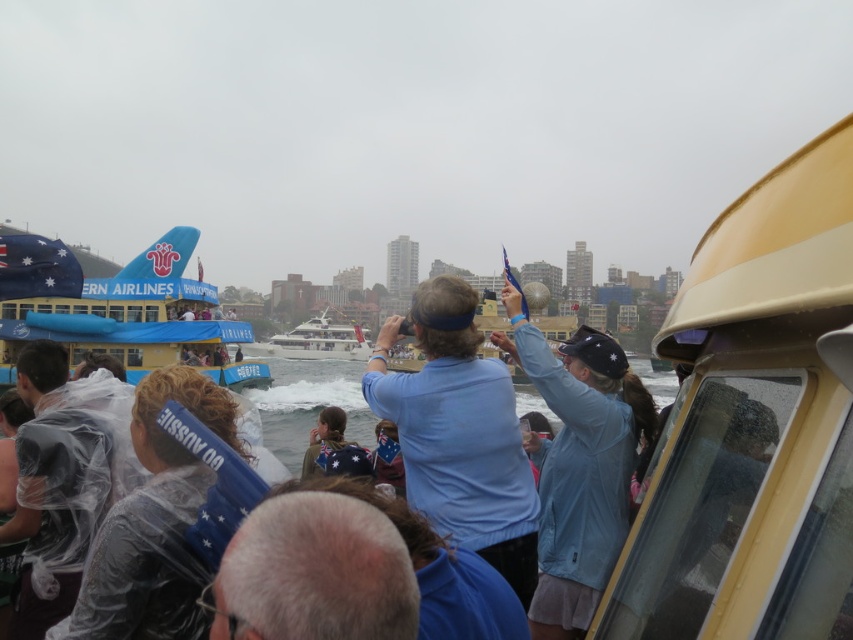
You are a photographer at the waterfront event. You want to capture a photo where the blue fabric at center and clear water at center are both visible. Based on their positions, which object will appear closer to the camera in the photo?

The blue fabric at center is in front of clear water at center, so it will appear closer to the camera in the photo.

You are an event organizer trying to set up a new banner between the blue fabric at center and the blue fabric boat at upper left. Which object should you place the banner closer to if you want it to be more noticeable to people standing at the front of the crowd?

The blue fabric boat at upper left occupies more space than the blue fabric at center, so placing the banner closer to the blue fabric boat at upper left would make it more noticeable to people at the front of the crowd.